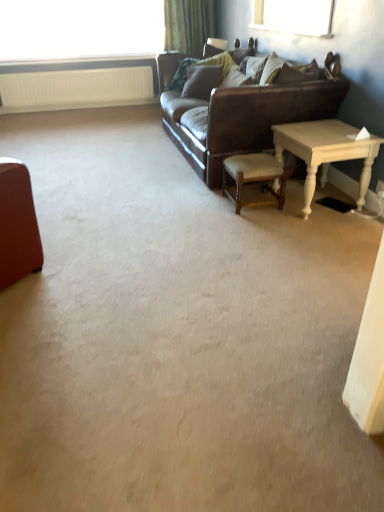
This screenshot has height=512, width=384. Identify the location of free spot in front of wooden chair at center. (255, 222).